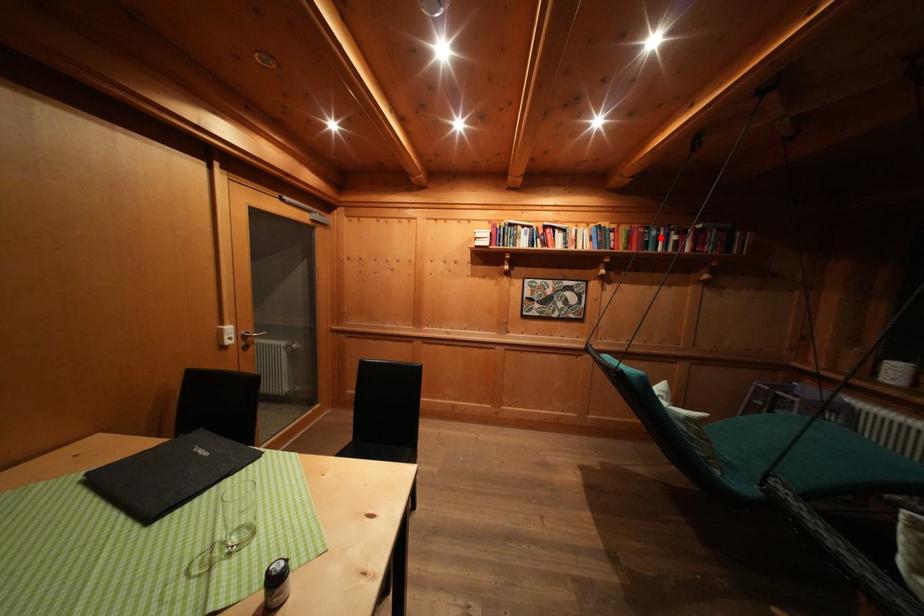
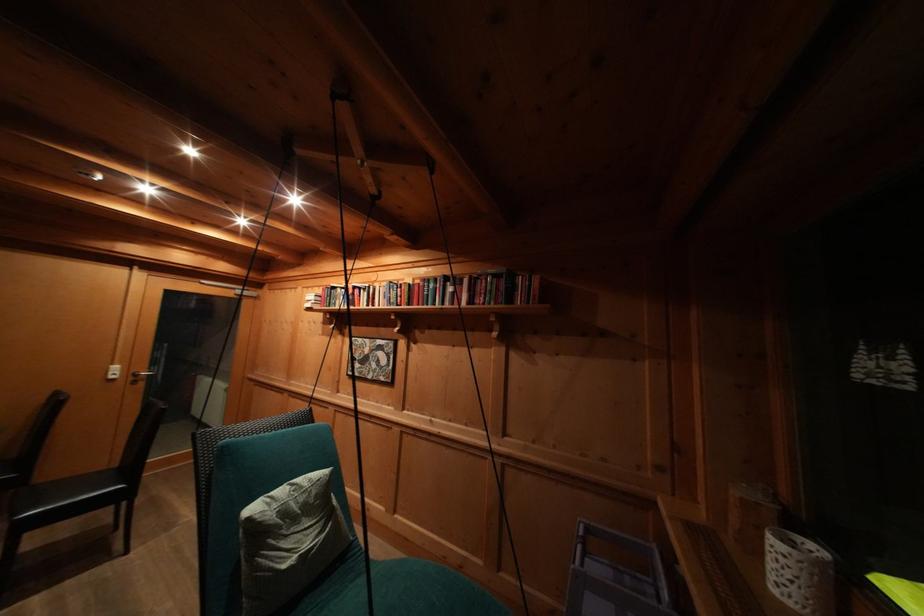
Find the pixel in the second image that matches the highlighted location in the first image.

(438, 291)